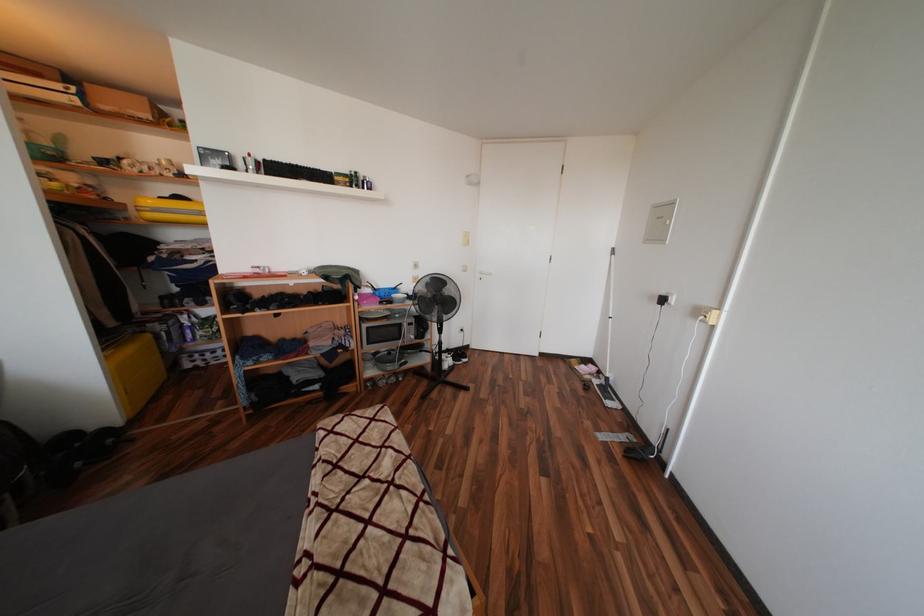
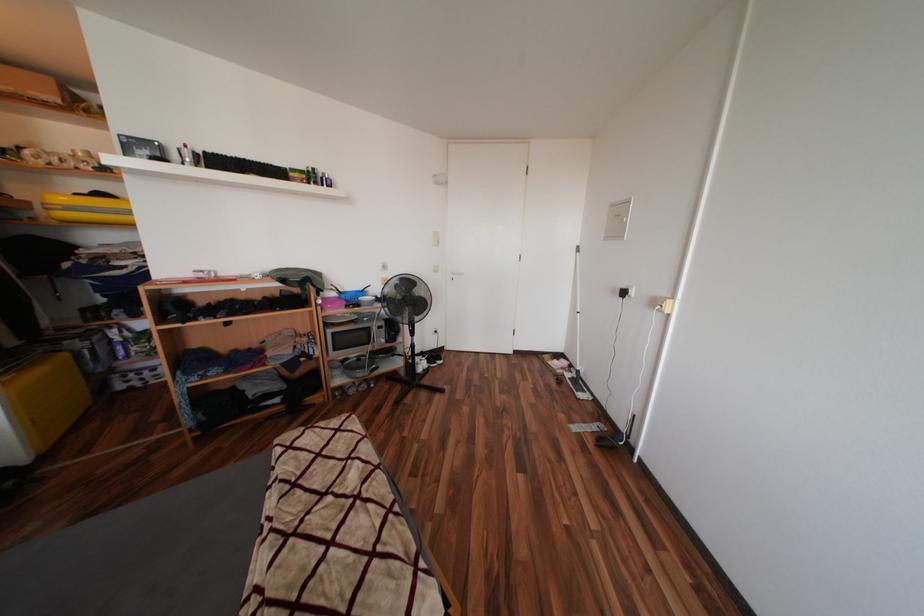
Question: The first image is from the beginning of the video and the second image is from the end. How did the camera likely rotate when shooting the video?

Choices:
 (A) Left
 (B) Right
 (C) Up
 (D) Down

Answer: (B)